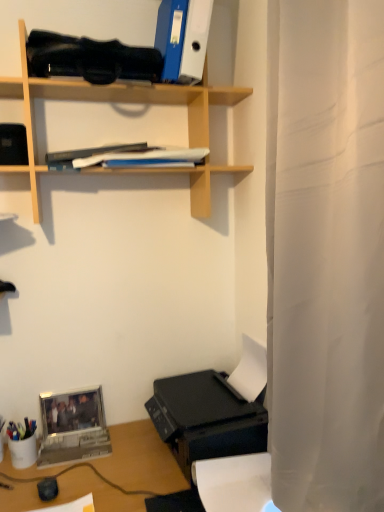
Find the location of a particular element. The width and height of the screenshot is (384, 512). black plastic printer at lower right is located at coordinates 206,418.

What do you see at coordinates (109, 102) in the screenshot?
I see `wooden shelf at upper center` at bounding box center [109, 102].

You are a GUI agent. You are given a task and a screenshot of the screen. Output one action in this format:
    pyautogui.click(x=<x>, y=<y>)
    Task: Click on the metallic silver laptop at lower left
    This screenshot has height=512, width=384.
    Given the screenshot: What is the action you would take?
    pyautogui.click(x=73, y=428)

Where is `blue matte book at upper center`? The image size is (384, 512). blue matte book at upper center is located at coordinates (125, 157).

From a real-world perspective, is multicolored plastic pen holder at lower left positioned over wooden shelf at upper center based on gravity?

No, from a real-world perspective, multicolored plastic pen holder at lower left is not above wooden shelf at upper center.

Is multicolored plastic pen holder at lower left in front of or behind wooden shelf at upper center in the image?

multicolored plastic pen holder at lower left is behind wooden shelf at upper center.

Would you say multicolored plastic pen holder at lower left contains wooden shelf at upper center?

No, wooden shelf at upper center is not surrounded by multicolored plastic pen holder at lower left.

Who is taller, multicolored plastic pen holder at lower left or wooden shelf at upper center?

With more height is wooden shelf at upper center.

From the image's perspective, which is below, black plastic printer at lower right or white fabric shower curtain at right?

From the image's view, black plastic printer at lower right is below.

Does black plastic printer at lower right have a larger size compared to white fabric shower curtain at right?

No.

Image resolution: width=384 pixels, height=512 pixels. I want to click on printer below the white fabric shower curtain at right (from a real-world perspective), so click(x=206, y=418).

Is metallic silver laptop at lower left placed right next to black plastic printer at lower right?

They are not placed beside each other.

Is metallic silver laptop at lower left inside the boundaries of black plastic printer at lower right, or outside?

metallic silver laptop at lower left is located beyond the bounds of black plastic printer at lower right.

In the image, is metallic silver laptop at lower left positioned in front of or behind black plastic printer at lower right?

metallic silver laptop at lower left is behind black plastic printer at lower right.

Based on the photo, can you confirm if blue matte folder at upper center is shorter than multicolored plastic pen holder at lower left?

No, blue matte folder at upper center is not shorter than multicolored plastic pen holder at lower left.

Is blue matte folder at upper center looking in the opposite direction of multicolored plastic pen holder at lower left?

No, multicolored plastic pen holder at lower left is not at the back of blue matte folder at upper center.

Does blue matte folder at upper center have a larger size compared to multicolored plastic pen holder at lower left?

Correct, blue matte folder at upper center is larger in size than multicolored plastic pen holder at lower left.

At what (x,y) coordinates should I click in order to perform the action: click on stationery located underneath the blue matte folder at upper center (from a real-world perspective). Please return your answer as a coordinate pair (x, y). Looking at the image, I should click on (22, 443).

Does black plastic printer at lower right touch blue matte folder at upper center?

No, black plastic printer at lower right is not making contact with blue matte folder at upper center.

Relative to blue matte folder at upper center, is black plastic printer at lower right in front or behind?

black plastic printer at lower right is behind blue matte folder at upper center.

From the image's perspective, is black plastic printer at lower right positioned above or below blue matte folder at upper center?

black plastic printer at lower right is below blue matte folder at upper center.

Is black plastic printer at lower right to the right of wooden shelf at upper center from the viewer's perspective?

Yes.

Is the depth of black plastic printer at lower right greater than that of wooden shelf at upper center?

Yes, it is behind wooden shelf at upper center.

Is black plastic printer at lower right in contact with wooden shelf at upper center?

No.

Considering the relative sizes of black plastic printer at lower right and wooden shelf at upper center in the image provided, is black plastic printer at lower right taller than wooden shelf at upper center?

Incorrect, the height of black plastic printer at lower right is not larger of that of wooden shelf at upper center.

Relative to blue matte book at upper center, is multicolored plastic pen holder at lower left in front or behind?

Visually, multicolored plastic pen holder at lower left is located behind blue matte book at upper center.

Looking at this image, would you consider multicolored plastic pen holder at lower left to be distant from blue matte book at upper center?

multicolored plastic pen holder at lower left is near blue matte book at upper center, not far away.

Is multicolored plastic pen holder at lower left turned away from blue matte book at upper center?

No, multicolored plastic pen holder at lower left's orientation is not away from blue matte book at upper center.

Which of these two, multicolored plastic pen holder at lower left or blue matte book at upper center, is bigger?

blue matte book at upper center is bigger.

You are a GUI agent. You are given a task and a screenshot of the screen. Output one action in this format:
    pyautogui.click(x=<x>, y=<y>)
    Task: Click on the shelf above the multicolored plastic pen holder at lower left (from the image's perspective)
    The height and width of the screenshot is (512, 384).
    Given the screenshot: What is the action you would take?
    pyautogui.click(x=109, y=102)

Find the location of `shower curtain above the black plastic printer at lower right (from a real-world perspective)`. shower curtain above the black plastic printer at lower right (from a real-world perspective) is located at coordinates (325, 254).

Based on the photo, looking at the image, which one is located closer to metallic silver laptop at lower left, blue matte folder at upper center or blue matte book at upper center?

blue matte book at upper center is closer to metallic silver laptop at lower left.

Considering their positions, is black plastic printer at lower right positioned further to blue matte book at upper center than wooden shelf at upper center?

black plastic printer at lower right is positioned further to the anchor blue matte book at upper center.

From the image, which object appears to be farther from metallic silver laptop at lower left, white fabric shower curtain at right or wooden shelf at upper center?

The object further to metallic silver laptop at lower left is white fabric shower curtain at right.

Considering their positions, is metallic silver laptop at lower left positioned further to blue matte book at upper center than black plastic printer at lower right?

Among the two, metallic silver laptop at lower left is located further to blue matte book at upper center.

Based on their spatial positions, is wooden shelf at upper center or blue matte folder at upper center further from blue matte book at upper center?

The object further to blue matte book at upper center is blue matte folder at upper center.

Which object lies nearer to the anchor point blue matte book at upper center, multicolored plastic pen holder at lower left or white fabric shower curtain at right?

white fabric shower curtain at right.

Based on their spatial positions, is blue matte book at upper center or wooden shelf at upper center further from black plastic printer at lower right?

blue matte book at upper center is positioned further to the anchor black plastic printer at lower right.

Estimate the real-world distances between objects in this image. Which object is further from blue matte book at upper center, wooden shelf at upper center or metallic silver laptop at lower left?

Based on the image, metallic silver laptop at lower left appears to be further to blue matte book at upper center.

Find the location of `printer between wooden shelf at upper center and multicolored plastic pen holder at lower left in the up-down direction`. printer between wooden shelf at upper center and multicolored plastic pen holder at lower left in the up-down direction is located at coordinates (206, 418).

At what (x,y) coordinates should I click in order to perform the action: click on book that lies between blue matte folder at upper center and multicolored plastic pen holder at lower left from top to bottom. Please return your answer as a coordinate pair (x, y). Looking at the image, I should click on (125, 157).

The image size is (384, 512). In order to click on shelf between white fabric shower curtain at right and blue matte book at upper center in the front-back direction in this screenshot , I will do `click(109, 102)`.

Identify the location of laptop that lies between wooden shelf at upper center and multicolored plastic pen holder at lower left from top to bottom. Image resolution: width=384 pixels, height=512 pixels. (73, 428).